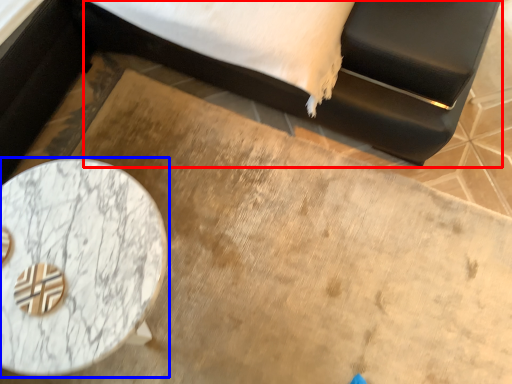
Question: Which object appears farthest to the camera in this image, bed (highlighted by a red box) or table (highlighted by a blue box)?

Choices:
 (A) bed
 (B) table

Answer: (B)